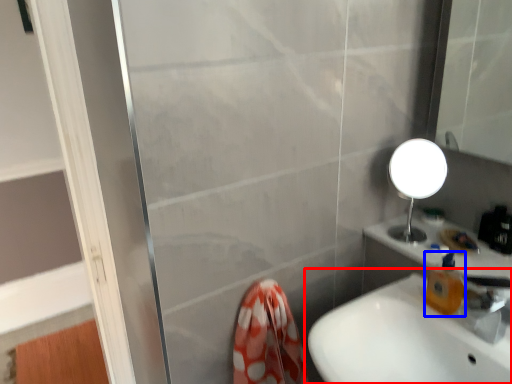
Question: Which object is closer to the camera taking this photo, sink (highlighted by a red box) or soap dispenser (highlighted by a blue box)?

Choices:
 (A) sink
 (B) soap dispenser

Answer: (A)